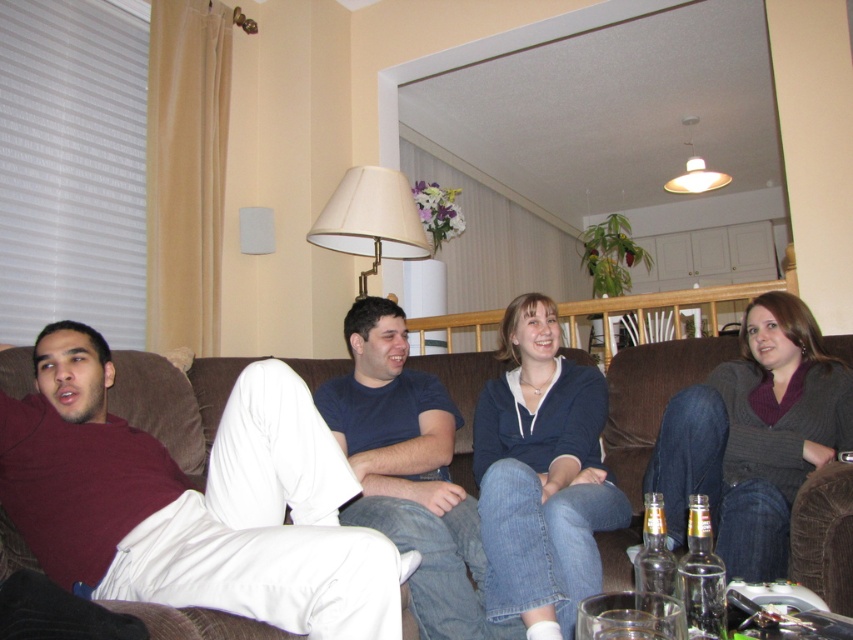
Describe the element at coordinates (541, 476) in the screenshot. I see `blue fleece sweatshirt at center` at that location.

Is blue fleece sweatshirt at center positioned at the back of white fabric lampshade at upper center?

No, it is in front of white fabric lampshade at upper center.

Where is `blue fleece sweatshirt at center`? The image size is (853, 640). blue fleece sweatshirt at center is located at coordinates (541, 476).

Can you confirm if white fabric lampshade at upper center is positioned to the left of clear glass bottle at lower center?

Correct, you'll find white fabric lampshade at upper center to the left of clear glass bottle at lower center.

Is point (338, 244) less distant than point (645, 513)?

No, (338, 244) is behind (645, 513).

Is point (363, 241) farther from camera compared to point (654, 579)?

Yes.

Find the location of a particular element. The image size is (853, 640). white fabric lampshade at upper center is located at coordinates (370, 220).

Based on the photo, which is more to the right, clear glass bottle at lower right or clear glass bottle at lower center?

Positioned to the right is clear glass bottle at lower right.

Between point (689, 628) and point (663, 616), which one is positioned in front?

Point (663, 616) is more forward.

The width and height of the screenshot is (853, 640). What are the coordinates of `clear glass bottle at lower right` in the screenshot? It's located at 701,577.